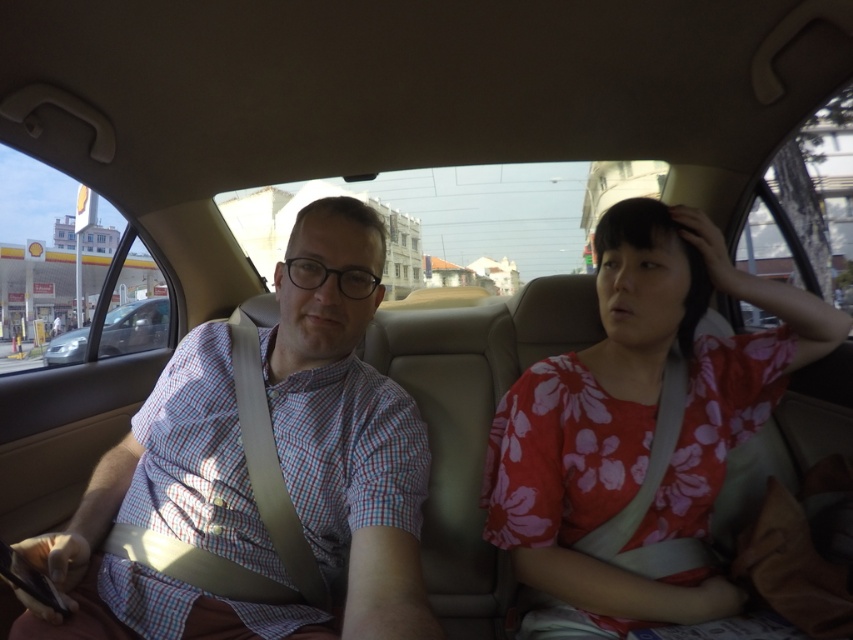
You are designing a car seat cover that needs to fit over both the checkered fabric shirt at left and the metallic silver sedan at left. Based on the car interior shown, which object requires a larger seat cover?

The metallic silver sedan at left requires a larger seat cover because its width is greater than the checkered fabric shirt at left.

You are sitting in the backseat of the car and want to hand a document to the person wearing the floral cotton shirt at right without disturbing the person in the checkered fabric shirt at left. How can you do this?

Since the checkered fabric shirt at left is in front of the floral cotton shirt at right, you can hand the document to the floral cotton shirt at right by passing it around the side of the checkered fabric shirt at left to avoid disturbing them.

In the scene shown: You are sitting in the backseat of the car and want to know what the man on the left is holding. The coordinates given are part of the car interior. Can you determine if the point at coordinates (250, 476) is part of the man on the left wearing a checkered shirt?

The point at coordinates (250, 476) corresponds to the checkered fabric shirt at left, so yes, it is part of the man on the left wearing a checkered shirt.